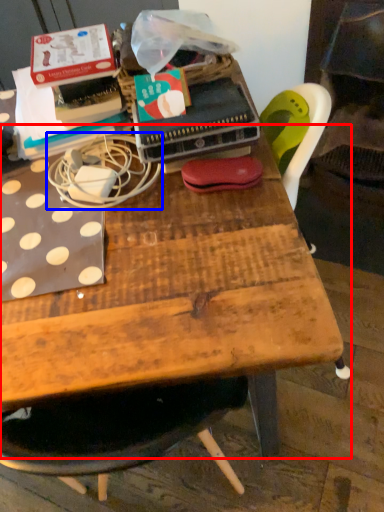
Question: Among these objects, which one is farthest to the camera, table (highlighted by a red box) or string (highlighted by a blue box)?

Choices:
 (A) table
 (B) string

Answer: (A)